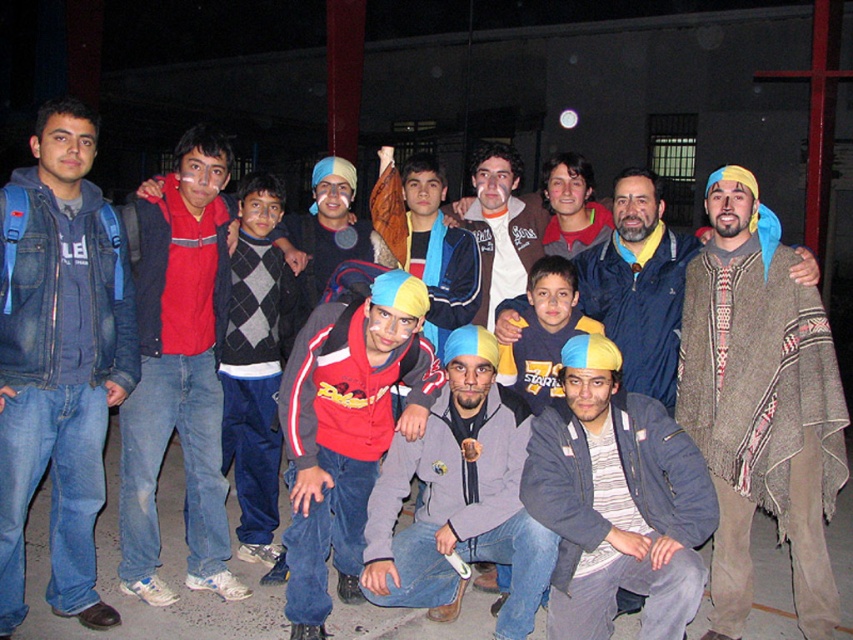
You are standing in the industrial area where the group is posing. You see a point at coordinates (460, 497). Which object from the scene does this point belong to?

The point at coordinates (460, 497) belongs to the matte gray hoodie at center.